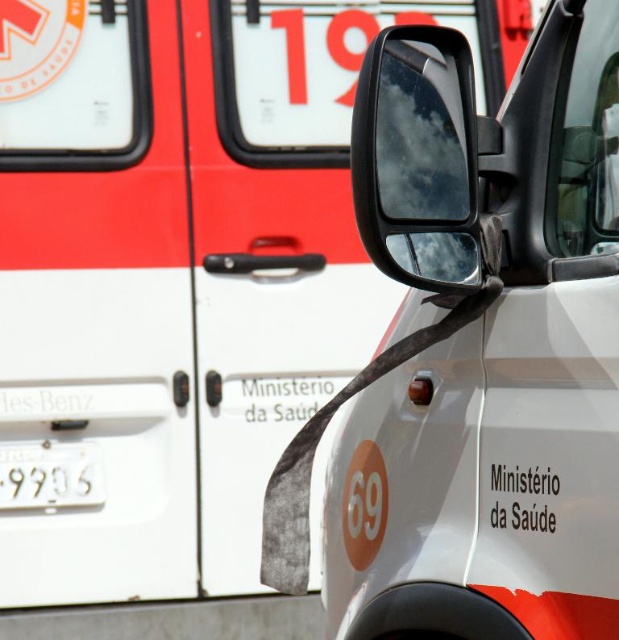
Question: Estimate the real-world distances between objects in this image. Which object is closer to the white matte car at center?

Choices:
 (A) white metallic license plate at lower left
 (B) glossy plastic rearview mirror at upper center

Answer: (B)

Question: Is glossy plastic rearview mirror at upper center positioned at the back of white metallic license plate at lower left?

Choices:
 (A) yes
 (B) no

Answer: (B)

Question: Considering the real-world distances, which object is closest to the glossy plastic rearview mirror at upper center?

Choices:
 (A) white matte car at center
 (B) white metallic license plate at lower left

Answer: (A)

Question: Does white matte car at center lie in front of white metallic license plate at lower left?

Choices:
 (A) yes
 (B) no

Answer: (A)

Question: From the image, what is the correct spatial relationship of white matte car at center in relation to white metallic license plate at lower left?

Choices:
 (A) below
 (B) above

Answer: (B)

Question: Which point appears closest to the camera in this image?

Choices:
 (A) (435, 58)
 (B) (581, 634)

Answer: (B)